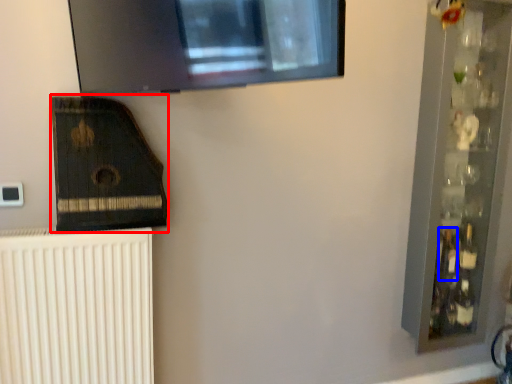
Question: Among these objects, which one is farthest to the camera, amplifier (highlighted by a red box) or bottle (highlighted by a blue box)?

Choices:
 (A) amplifier
 (B) bottle

Answer: (B)